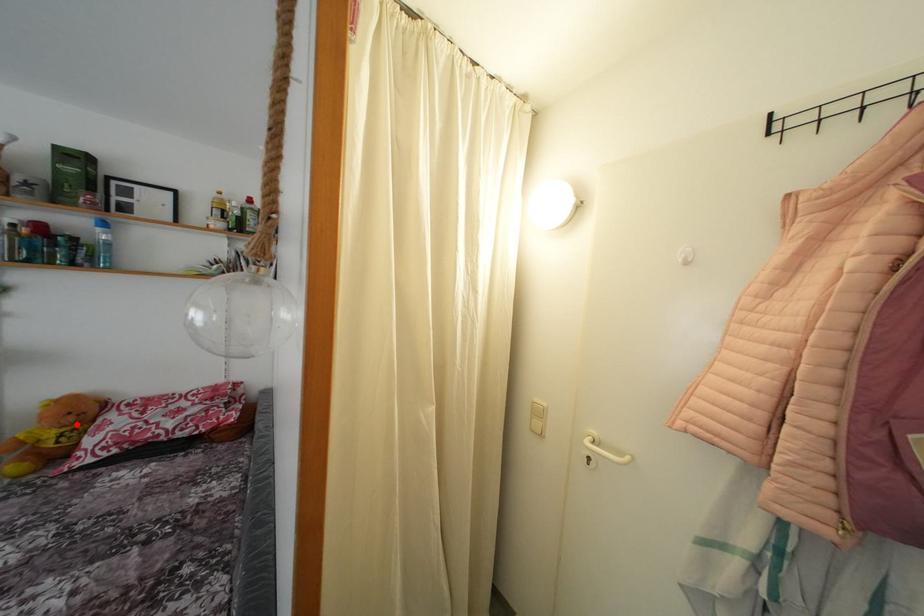
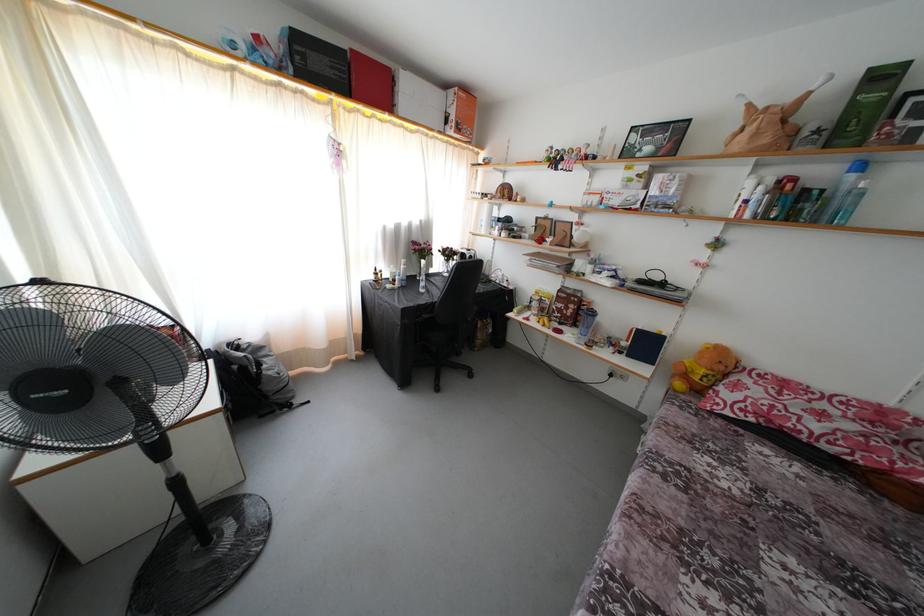
Find the pixel in the second image that matches the highlighted location in the first image.

(726, 373)